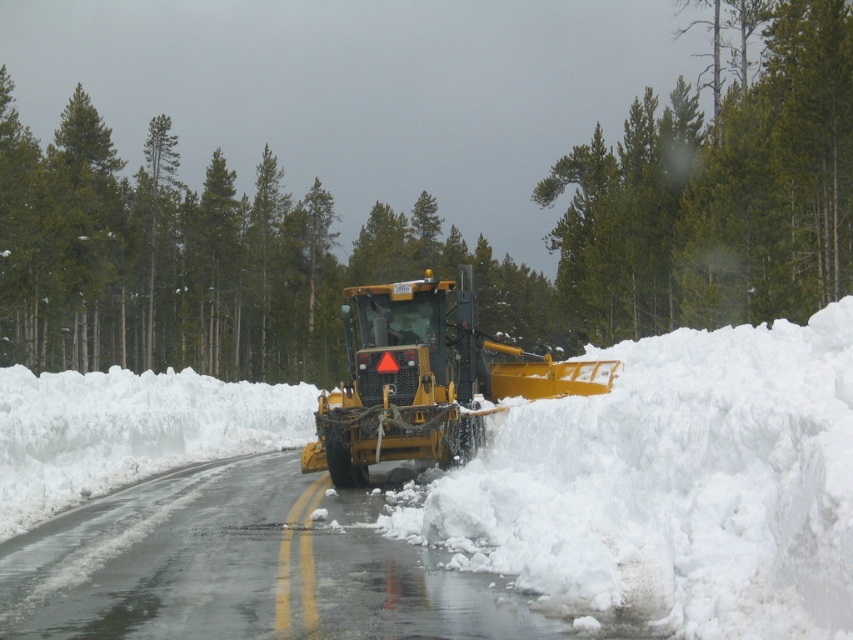
You are a delivery driver trying to navigate through the snowy road. You see a green textured pine at center and a white fluffy snow at center. Which object is higher in the scene?

The green textured pine at center is above the white fluffy snow at center, so the green textured pine at center is higher in the scene.

You are standing at the snowplow and want to determine which of the two points, point [610,497] or point [718,179], is closer to you. Based on the coordinates given, which point is nearer?

Point [610,497] is closer to the camera than point [718,179], so it is the nearer point.

You are standing at the snowplow and looking towards the road. There are two points marked on the road ahead of you. Which point is closer to you, point at coordinate (577, 189) or point at coordinate (595, 252)?

Point at coordinate (595, 252) is closer to you because it is less further to the camera than point at coordinate (577, 189).